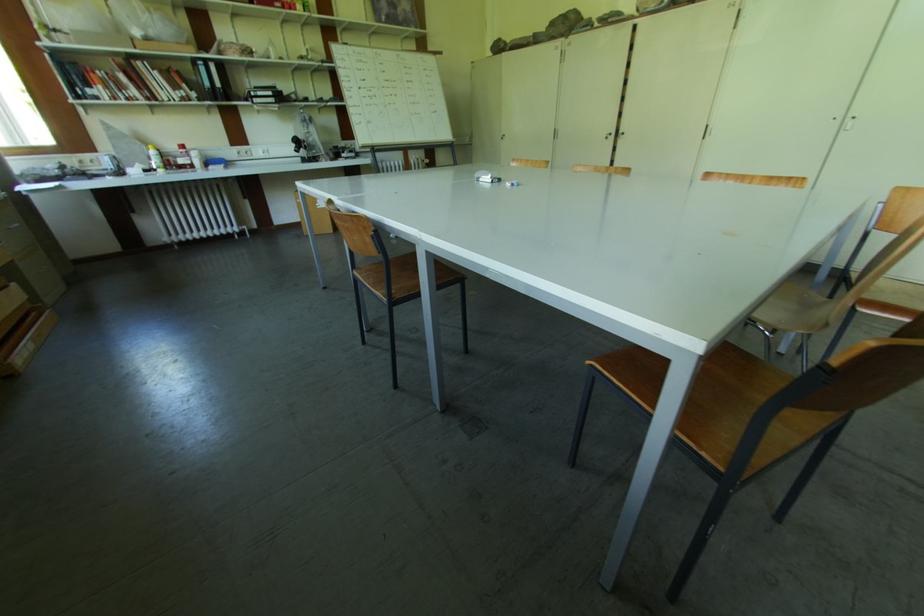
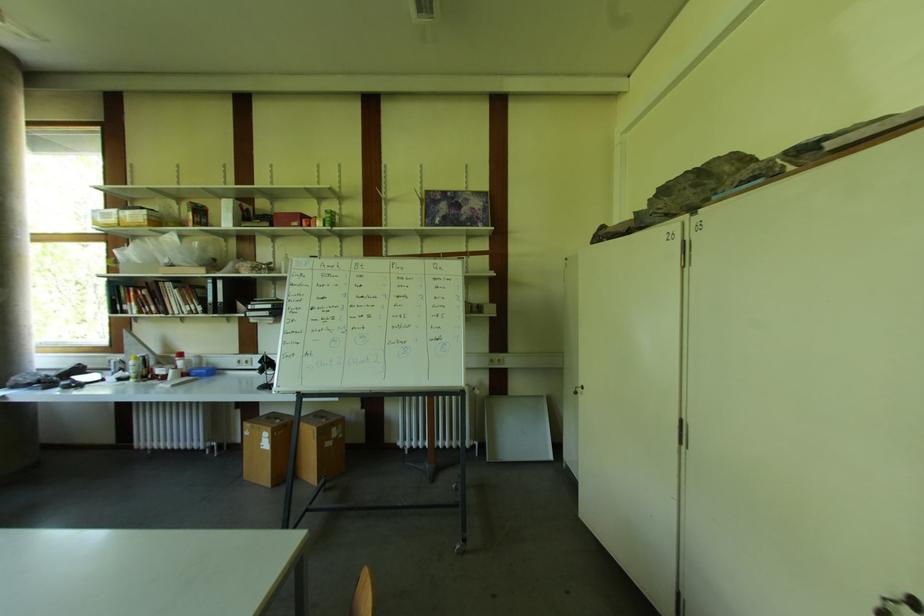
In the second image, find the point that corresponds to (505,140) in the first image.

(578, 395)